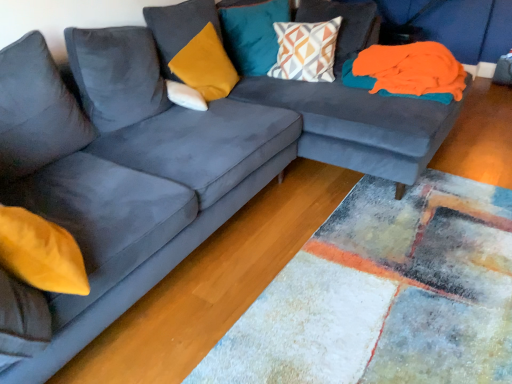
Question: Considering the positions of point (411, 74) and point (192, 96), is point (411, 74) closer or farther from the camera than point (192, 96)?

Choices:
 (A) closer
 (B) farther

Answer: (A)

Question: From the image's perspective, is orange fabric at upper right above or below white soft pillow at center, the first pillow in the left-to-right sequence?

Choices:
 (A) below
 (B) above

Answer: (B)

Question: Estimate the real-world distances between objects in this image. Which object is closer to the teal velvet cushion at upper center, acting as the second pillow starting from the right?

Choices:
 (A) velvet mustard pillow at upper center, the 3th pillow from the right
 (B) orange fabric at upper right
 (C) geometric-patterned fabric pillow at upper center, which is counted as the 4th pillow, starting from the left
 (D) white soft pillow at center, the first pillow in the left-to-right sequence

Answer: (C)

Question: Which of these objects is positioned closest to the white soft pillow at center, arranged as the fourth pillow when viewed from the right?

Choices:
 (A) velvet mustard pillow at upper center, marked as the 2th pillow in a left-to-right arrangement
 (B) orange fabric at upper right
 (C) teal velvet cushion at upper center, positioned as the 3th pillow in left-to-right order
 (D) geometric-patterned fabric pillow at upper center, arranged as the first pillow when viewed from the right

Answer: (A)